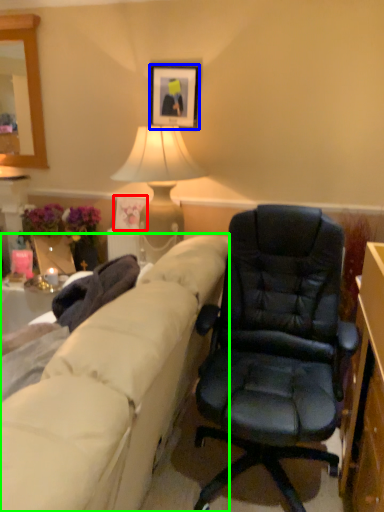
Question: Which object is positioned closest to picture frame (highlighted by a red box)? Select from picture frame (highlighted by a blue box) and studio couch (highlighted by a green box).

Choices:
 (A) picture frame
 (B) studio couch

Answer: (A)